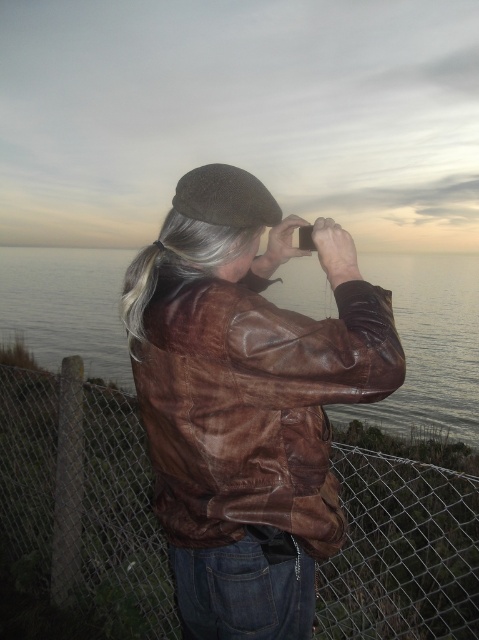
Question: Which of the following is the closest to the observer?

Choices:
 (A) brown felt beret at upper center
 (B) metallic wire mesh at center

Answer: (A)

Question: From the image, what is the correct spatial relationship of brown leather jacket at center in relation to brown felt beret at upper center?

Choices:
 (A) left
 (B) right

Answer: (B)

Question: Can you confirm if metallic wire mesh at center is positioned below brown felt beret at upper center?

Choices:
 (A) yes
 (B) no

Answer: (A)

Question: Which object appears closest to the camera in this image?

Choices:
 (A) brown leather water at center
 (B) brown leather jacket at center
 (C) metallic wire mesh at center

Answer: (B)

Question: Is brown leather jacket at center below brown leather water at center?

Choices:
 (A) yes
 (B) no

Answer: (A)

Question: Estimate the real-world distances between objects in this image. Which object is closer to the brown leather jacket at center?

Choices:
 (A) metallic wire mesh at center
 (B) brown leather water at center
 (C) brown felt beret at upper center

Answer: (C)